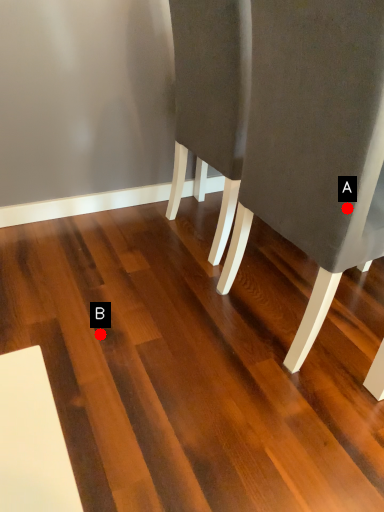
Question: Two points are circled on the image, labeled by A and B beside each circle. Among these points, which one is nearest to the camera?

Choices:
 (A) A is closer
 (B) B is closer

Answer: (A)